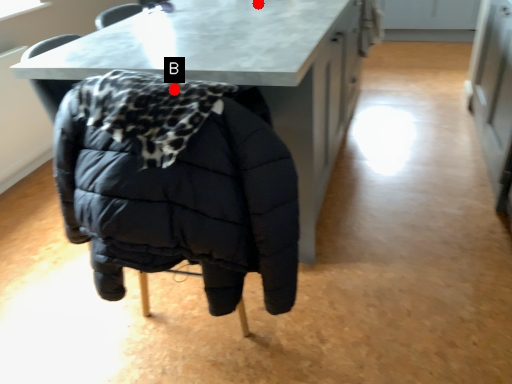
Question: Two points are circled on the image, labeled by A and B beside each circle. Among these points, which one is farthest from the camera?

Choices:
 (A) A is further
 (B) B is further

Answer: (A)